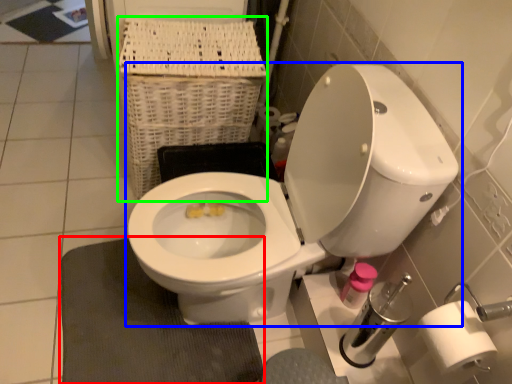
Question: Which is nearer to the bath mat (highlighted by a red box)? toilet (highlighted by a blue box) or basket (highlighted by a green box).

Choices:
 (A) toilet
 (B) basket

Answer: (A)